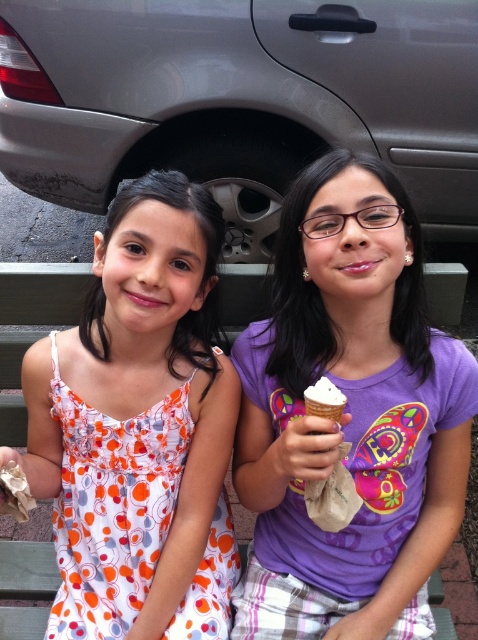
Question: Is green wood park bench at center to the left of white waffle cone at center from the viewer's perspective?

Choices:
 (A) no
 (B) yes

Answer: (B)

Question: Which is nearer to the green wood park bench at center?

Choices:
 (A) white dotted dress at center
 (B) silver metallic car at center
 (C) purple cotton shirt at center
 (D) white waffle cone at center

Answer: (A)

Question: Which point is farther to the camera?

Choices:
 (A) (358, 19)
 (B) (313, 413)

Answer: (A)

Question: Can you confirm if green wood park bench at center is bigger than white waffle cone at center?

Choices:
 (A) yes
 (B) no

Answer: (A)

Question: Can you confirm if silver metallic car at center is wider than white dotted dress at center?

Choices:
 (A) no
 (B) yes

Answer: (B)

Question: Which point is closer to the camera?

Choices:
 (A) white waffle cone at center
 (B) white dotted dress at center
 (C) silver metallic car at center
 (D) green wood park bench at center

Answer: (A)